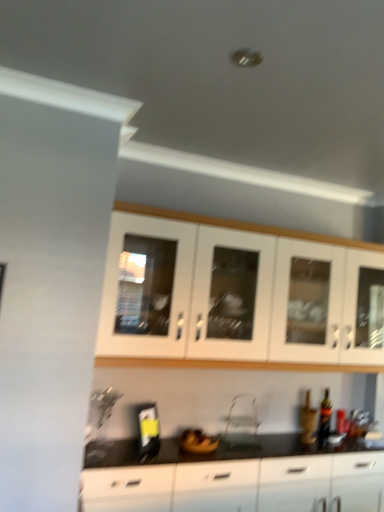
This screenshot has width=384, height=512. Identify the location of vacant area situated below clear plastic folding chair at center (from a real-world perspective). (253, 445).